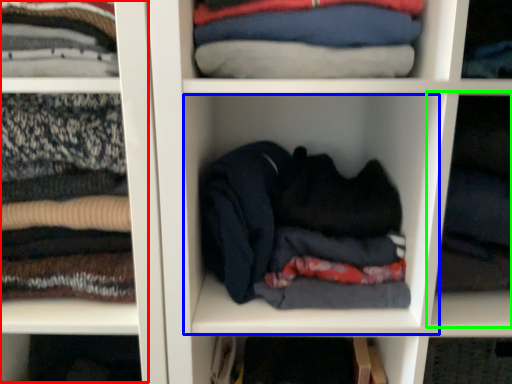
Question: Estimate the real-world distances between objects in this image. Which object is farther from cabinet (highlighted by a red box), cabinet (highlighted by a blue box) or cabinet (highlighted by a green box)?

Choices:
 (A) cabinet
 (B) cabinet

Answer: (B)